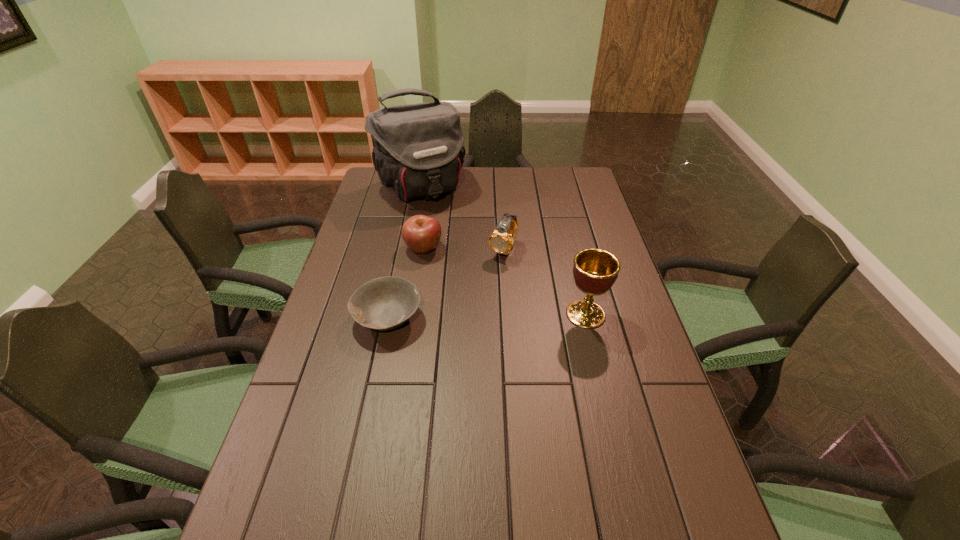
Find the location of `bowl that is at the left edge`. bowl that is at the left edge is located at coordinates (385, 303).

Identify the location of shoulder bag that is positioned at the left edge. (418, 151).

Find the location of a particular element. This screenshot has width=960, height=540. object present at the right edge is located at coordinates (595, 270).

The width and height of the screenshot is (960, 540). I want to click on object at the far left corner, so click(418, 151).

Where is `free space at the far edge of the desktop`? free space at the far edge of the desktop is located at coordinates (516, 181).

You are a GUI agent. You are given a task and a screenshot of the screen. Output one action in this format:
    pyautogui.click(x=<x>, y=<y>)
    Task: Click on the vacant space at the near edge
    
    Given the screenshot: What is the action you would take?
    click(x=521, y=490)

Locate an element on the screen. blank space at the left edge of the desktop is located at coordinates (359, 357).

In the image, there is a desktop. Where is `free space at the right edge`? This screenshot has width=960, height=540. free space at the right edge is located at coordinates (574, 239).

This screenshot has height=540, width=960. I want to click on free space at the far right corner, so click(591, 195).

The height and width of the screenshot is (540, 960). What are the coordinates of `free area in between the apple and the fourth object from left to right` in the screenshot? It's located at (464, 249).